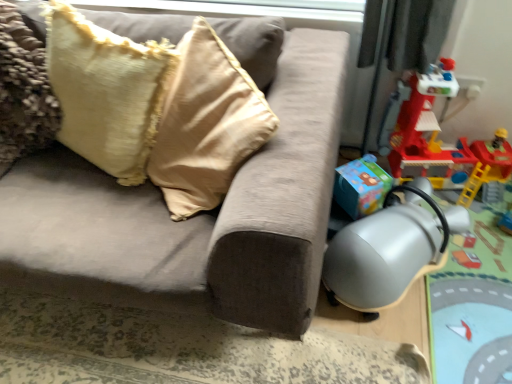
Question: Does velvet beige pillow at upper left have a smaller size compared to rubberized red playset at right?

Choices:
 (A) no
 (B) yes

Answer: (B)

Question: From a real-world perspective, is velvet beige pillow at upper left over rubberized red playset at right?

Choices:
 (A) yes
 (B) no

Answer: (A)

Question: Is velvet beige pillow at upper left turned away from rubberized red playset at right?

Choices:
 (A) no
 (B) yes

Answer: (A)

Question: Does velvet beige pillow at upper left have a lesser height compared to rubberized red playset at right?

Choices:
 (A) no
 (B) yes

Answer: (B)

Question: Can rubberized red playset at right be found inside velvet beige pillow at upper left?

Choices:
 (A) yes
 (B) no

Answer: (B)

Question: Considering the positions of suede-like beige couch at center and silver metallic swivel chair at lower right in the image, is suede-like beige couch at center taller or shorter than silver metallic swivel chair at lower right?

Choices:
 (A) short
 (B) tall

Answer: (B)

Question: Would you say suede-like beige couch at center is inside or outside silver metallic swivel chair at lower right?

Choices:
 (A) outside
 (B) inside

Answer: (A)

Question: In terms of width, does suede-like beige couch at center look wider or thinner when compared to silver metallic swivel chair at lower right?

Choices:
 (A) wide
 (B) thin

Answer: (A)

Question: From the image's perspective, is suede-like beige couch at center above or below silver metallic swivel chair at lower right?

Choices:
 (A) below
 (B) above

Answer: (B)

Question: Is point (459, 201) positioned closer to the camera than point (2, 246)?

Choices:
 (A) farther
 (B) closer

Answer: (A)

Question: From a real-world perspective, is rubberized red playset at right physically located above or below suede-like beige couch at center?

Choices:
 (A) below
 (B) above

Answer: (A)

Question: From their relative heights in the image, would you say rubberized red playset at right is taller or shorter than suede-like beige couch at center?

Choices:
 (A) short
 (B) tall

Answer: (B)

Question: Which is correct: rubberized red playset at right is inside suede-like beige couch at center, or outside of it?

Choices:
 (A) inside
 (B) outside

Answer: (B)

Question: From the image's perspective, is velvet beige pillow at upper left positioned above or below silver metallic swivel chair at lower right?

Choices:
 (A) above
 (B) below

Answer: (A)

Question: Is point (73, 21) positioned closer to the camera than point (445, 258)?

Choices:
 (A) closer
 (B) farther

Answer: (A)